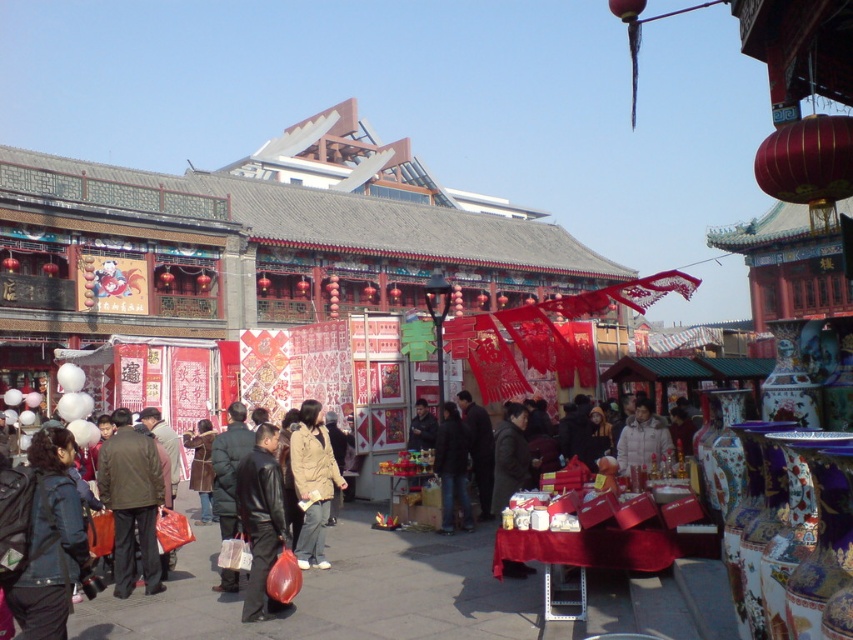
Which of these two, dark blue leather jacket at lower left or dark brown leather jacket at center, stands taller?

Standing taller between the two is dark blue leather jacket at lower left.

Is dark blue leather jacket at lower left smaller than dark brown leather jacket at center?

Incorrect, dark blue leather jacket at lower left is not smaller in size than dark brown leather jacket at center.

Does point (70, 440) come farther from viewer compared to point (132, 490)?

No.

The width and height of the screenshot is (853, 640). Find the location of `dark blue leather jacket at lower left`. dark blue leather jacket at lower left is located at coordinates (50, 540).

Between point (221, 588) and point (654, 458), which one is positioned behind?

The point (654, 458) is more distant.

Does black leather jacket at center appear under white matte jacket at center?

Yes, black leather jacket at center is below white matte jacket at center.

At what (x,y) coordinates should I click in order to perform the action: click on black leather jacket at center. Please return your answer as a coordinate pair (x, y). The height and width of the screenshot is (640, 853). Looking at the image, I should click on (229, 467).

Locate an element on the screen. black leather jacket at center is located at coordinates (229, 467).

Who is shorter, dark blue leather jacket at lower left or leather jacket at center?

With less height is leather jacket at center.

Is dark blue leather jacket at lower left smaller than leather jacket at center?

Actually, dark blue leather jacket at lower left might be larger than leather jacket at center.

Where is `dark blue leather jacket at lower left`? The height and width of the screenshot is (640, 853). dark blue leather jacket at lower left is located at coordinates (50, 540).